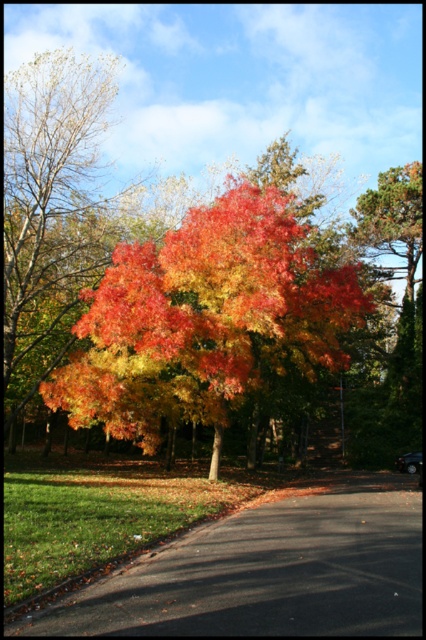
Question: Is vivid autumn leaves at center to the left of black asphalt road at lower center from the viewer's perspective?

Choices:
 (A) yes
 (B) no

Answer: (A)

Question: Is the position of vivid autumn leaves at center more distant than that of black asphalt road at lower center?

Choices:
 (A) yes
 (B) no

Answer: (A)

Question: Which point is farther to the camera?

Choices:
 (A) vivid autumn leaves at center
 (B) black asphalt road at lower center

Answer: (A)

Question: From the image, what is the correct spatial relationship of vivid autumn leaves at center in relation to black asphalt road at lower center?

Choices:
 (A) below
 (B) above

Answer: (B)

Question: Which point is farther to the camera?

Choices:
 (A) (126, 593)
 (B) (103, 417)

Answer: (B)

Question: Which of the following is the farthest from the observer?

Choices:
 (A) (298, 602)
 (B) (138, 292)

Answer: (B)